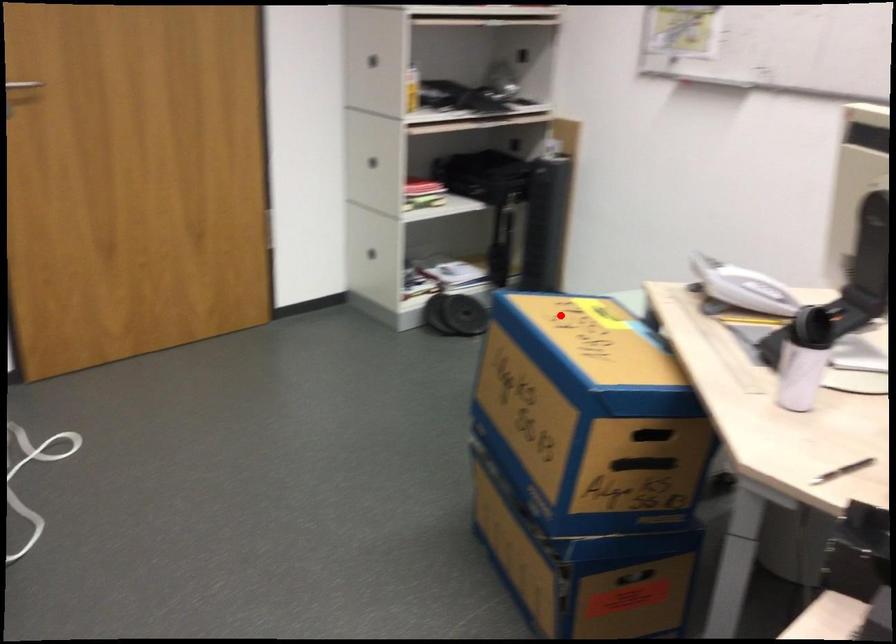
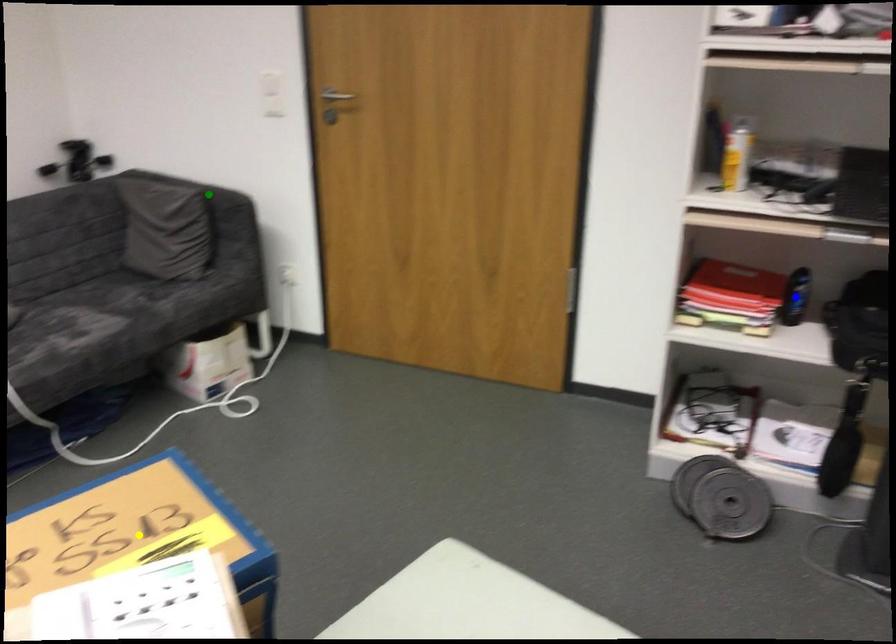
Question: I am providing you with two images of the same scene from different viewpoints. A red point is marked on the first image. You are given multiple points on the second image. Which point in image 2 is actually the same real-world point as the red point in image 1?

Choices:
 (A) green point
 (B) yellow point
 (C) blue point

Answer: (B)